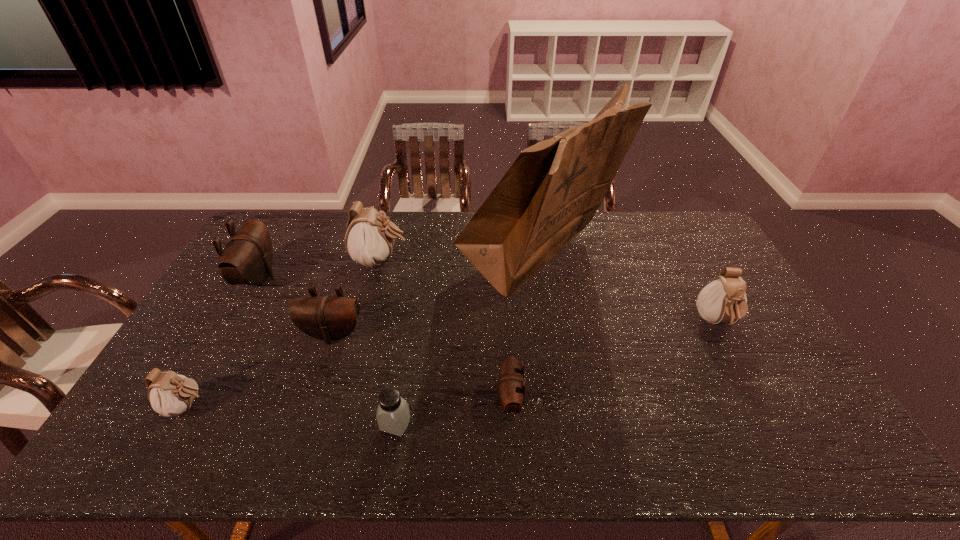
Locate an element on the screen. This screenshot has width=960, height=540. the leftmost white pouch is located at coordinates (170, 394).

Locate an element on the screen. the nearest white pouch is located at coordinates (170, 394).

Identify the location of the smallest brown pouch. (511, 385).

At what (x,y) coordinates should I click in order to perform the action: click on the rightmost brown pouch. Please return your answer as a coordinate pair (x, y). Image resolution: width=960 pixels, height=540 pixels. Looking at the image, I should click on pyautogui.click(x=511, y=385).

You are a GUI agent. You are given a task and a screenshot of the screen. Output one action in this format:
    pyautogui.click(x=<x>, y=<y>)
    Task: Click on the fourth object from right to left
    This screenshot has height=540, width=960.
    Given the screenshot: What is the action you would take?
    (393, 415)

I want to click on free region located 0.270m on the right of the grocery bag, so click(691, 263).

Identify the location of vacant region located on the front-facing side of the farthest white pouch. (501, 261).

You are a GUI agent. You are given a task and a screenshot of the screen. Output one action in this format:
    pyautogui.click(x=<x>, y=<y>)
    Task: Click on the free point located with the flap open on the farthest brown pouch
    This screenshot has height=540, width=960.
    Given the screenshot: What is the action you would take?
    pyautogui.click(x=371, y=278)

Where is `free space located 0.110m on the front-facing side of the rightmost object`? Image resolution: width=960 pixels, height=540 pixels. free space located 0.110m on the front-facing side of the rightmost object is located at coordinates (744, 376).

This screenshot has height=540, width=960. I want to click on vacant space located 0.170m with the flap open on the second smallest brown pouch, so [312, 398].